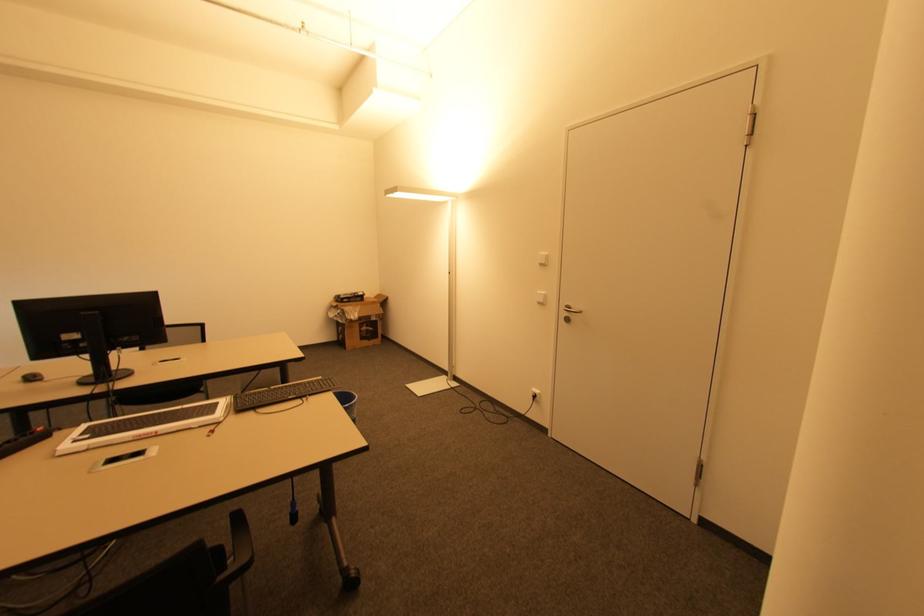
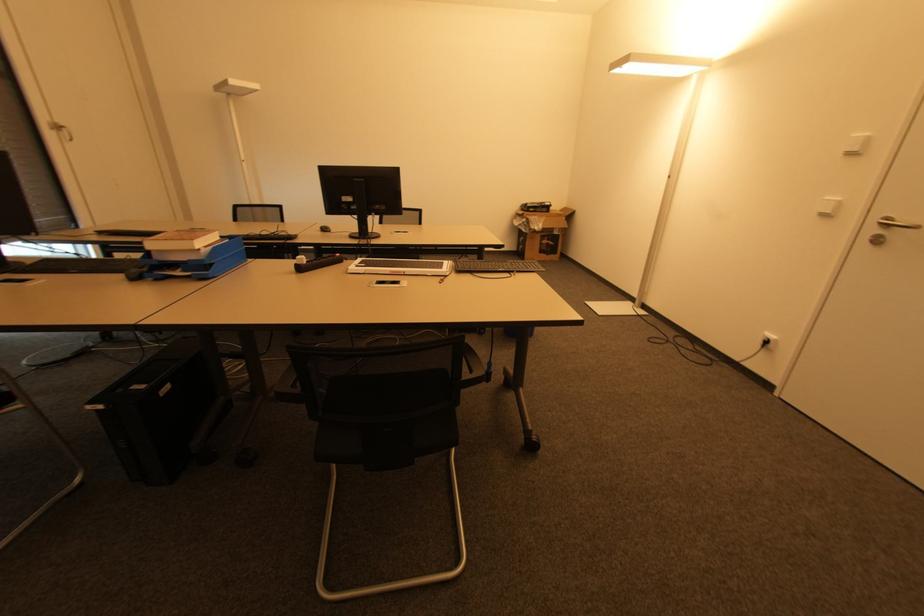
Question: The camera is either moving clockwise (left) or counter-clockwise (right) around the object. The first image is from the beginning of the video and the second image is from the end. Is the camera moving left or right when shooting the video?

Choices:
 (A) Left
 (B) Right

Answer: (B)